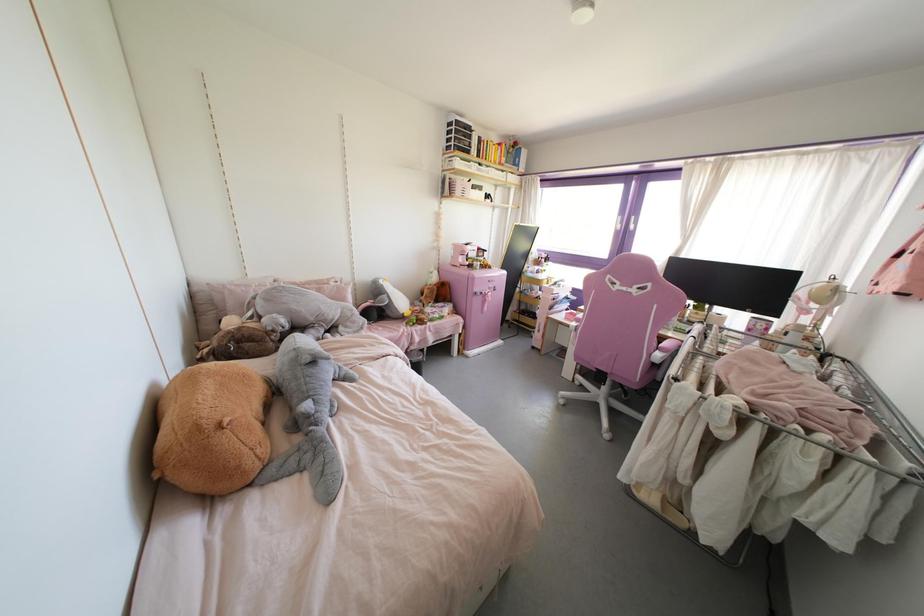
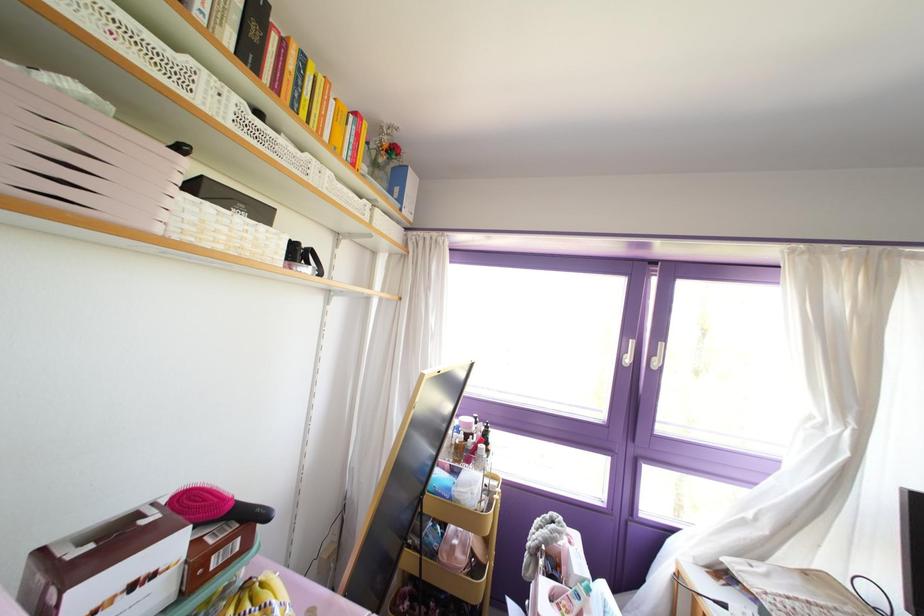
Find the pixel in the second image that matches (x=617, y=225) in the first image.

(626, 360)